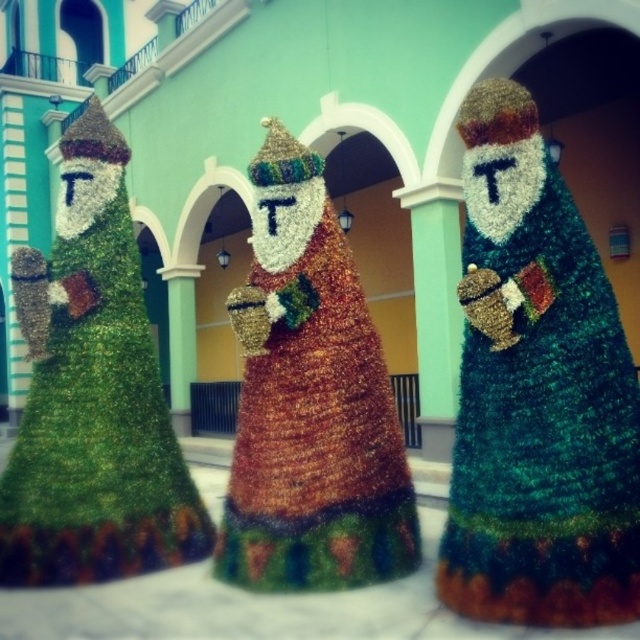
You are planning to place a small decoration on top of the green textured santa claus at center and the gold textured santa claus at center. Which one can you place the decoration on without it falling off?

The gold textured santa claus at center is taller than the green textured santa claus at center, so placing the decoration on top of the gold textured santa claus at center would be more stable and less likely to fall off.

You are an observer standing in front of the Three Kings display. You notice the green textured santa claus at center and the gold textured santa claus at center. Which of these two figures is narrower in width?

The green textured santa claus at center is narrower in width compared to the gold textured santa claus at center according to the description.

You are an event planner organizing a Christmas display. You have two santas, the green textured santa claus at center and the gold textured santa claus at center. Which one requires a larger base to stand stably?

The gold textured santa claus at center requires a larger base because it is bigger than the green textured santa claus at center.